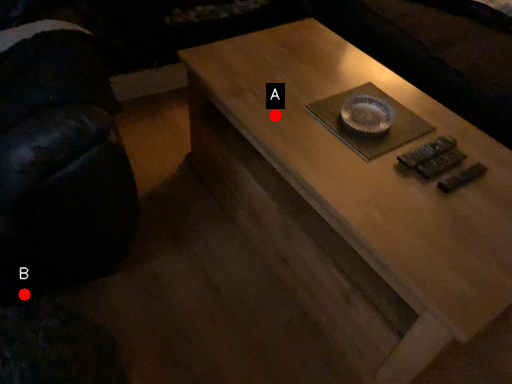
Question: Two points are circled on the image, labeled by A and B beside each circle. Which point is further to the camera?

Choices:
 (A) A is further
 (B) B is further

Answer: (B)